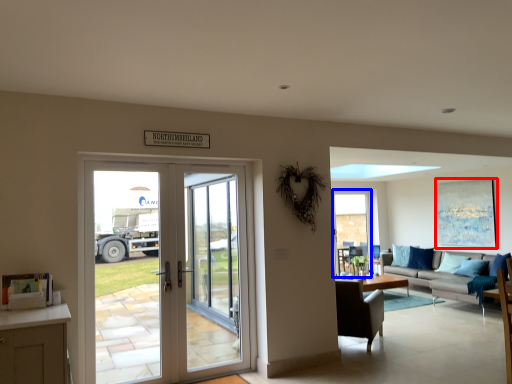
Question: Which object appears closest to the camera in this image, picture frame (highlighted by a red box) or window screen (highlighted by a blue box)?

Choices:
 (A) picture frame
 (B) window screen

Answer: (A)